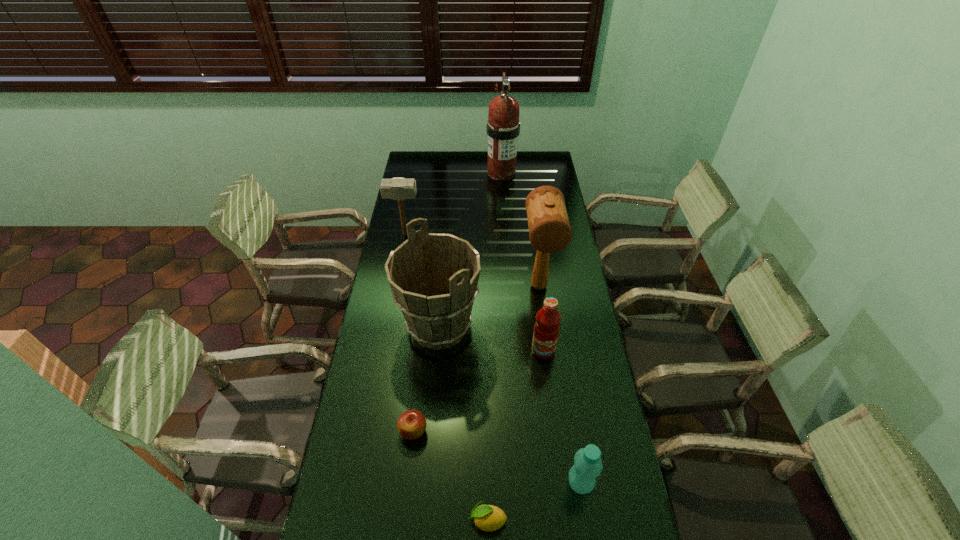
Find the location of a particular element. The image size is (960, 540). vacant space that is in between the seventh nearest object and the nearest object is located at coordinates (446, 377).

Identify the location of vacant space that's between the right mallet and the nearest object. (514, 403).

Identify which object is the seventh nearest to the third shortest object. Please provide its 2D coordinates. Your answer should be formatted as a tuple, i.e. [(x, y)], where the tuple contains the x and y coordinates of a point satisfying the conditions above.

[(503, 127)]

At what (x,y) coordinates should I click in order to perform the action: click on object that is the seventh closest to the fruit juice. Please return your answer as a coordinate pair (x, y). Looking at the image, I should click on (503, 127).

Locate an element on the screen. The image size is (960, 540). vacant space that satisfies the following two spatial constraints: 1. on the striking face of the shorter mallet; 2. on the left side of the sixth farthest object is located at coordinates [x=369, y=431].

This screenshot has height=540, width=960. What are the coordinates of `vacant space that satisfies the following two spatial constraints: 1. on the striking face of the second farthest object; 2. on the left side of the bucket` in the screenshot? It's located at (388, 327).

Identify the location of vacant region that satisfies the following two spatial constraints: 1. on the striking face of the bucket; 2. on the right side of the left mallet. This screenshot has height=540, width=960. (388, 327).

This screenshot has width=960, height=540. Identify the location of blank space that satisfies the following two spatial constraints: 1. at the nozzle of the farthest object; 2. on the striking face of the shorter mallet. (506, 234).